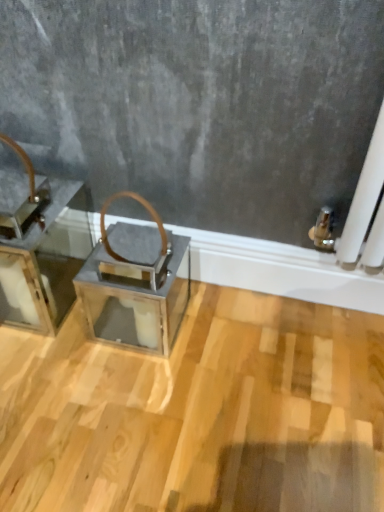
Question: Choose the correct answer: Is metallic silver tray at left inside metallic gray lantern at center or outside it?

Choices:
 (A) inside
 (B) outside

Answer: (B)

Question: From the image's perspective, relative to metallic gray lantern at center, is metallic silver tray at left above or below?

Choices:
 (A) above
 (B) below

Answer: (A)

Question: Considering their positions, is metallic silver tray at left located in front of or behind metallic gray lantern at center?

Choices:
 (A) behind
 (B) front

Answer: (B)

Question: Is metallic gray lantern at center inside or outside of metallic silver tray at left?

Choices:
 (A) inside
 (B) outside

Answer: (B)

Question: From the image's perspective, is metallic gray lantern at center above or below metallic silver tray at left?

Choices:
 (A) below
 (B) above

Answer: (A)

Question: From a real-world perspective, is metallic gray lantern at center above or below metallic silver tray at left?

Choices:
 (A) below
 (B) above

Answer: (A)

Question: Is point (145, 253) closer or farther from the camera than point (64, 270)?

Choices:
 (A) closer
 (B) farther

Answer: (A)